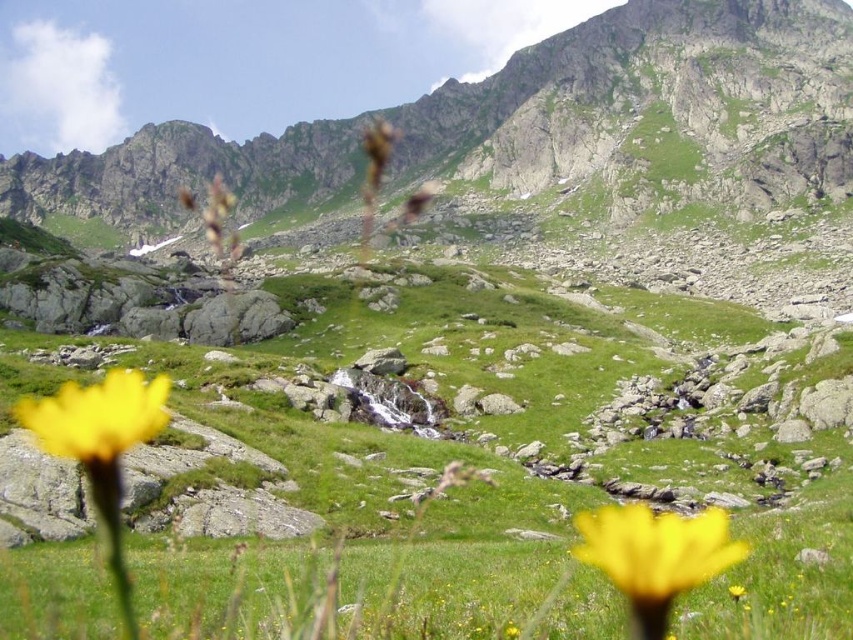
Consider the image. You are standing in the mountain landscape and want to take a photo. You have two points marked on your camera screen at coordinates point [143,218] and point [733,595]. Which point is closer to you?

Point [733,595] is closer to you because point [143,218] is further to the camera than point [733,595].

You are a hiker standing at the base of the green rocky mountain at upper center and want to place a yellow matte flower at lower right at its base. Can you determine if the mountain is wide enough to accommodate the flower?

The green rocky mountain at upper center might be wider than yellow matte flower at lower right, so it is possible the mountain is wide enough to place the flower at its base.